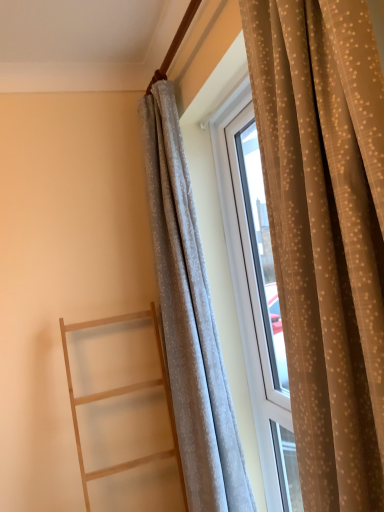
Question: In terms of height, does light wood ladder at left look taller or shorter compared to light gray sheer curtain at right, marked as the 2th curtain in a back-to-front arrangement?

Choices:
 (A) tall
 (B) short

Answer: (B)

Question: In terms of size, does light wood ladder at left appear bigger or smaller than light gray sheer curtain at right, positioned as the 1th curtain in front-to-back order?

Choices:
 (A) small
 (B) big

Answer: (A)

Question: Estimate the real-world distances between objects in this image. Which object is farther from the light gray sheer curtain at right, marked as the 2th curtain in a back-to-front arrangement?

Choices:
 (A) white sheer curtain at center, positioned as the 1th curtain in back-to-front order
 (B) light wood ladder at left

Answer: (B)

Question: Which is nearer to the white sheer curtain at center, the 2th curtain from the front?

Choices:
 (A) light gray sheer curtain at right, marked as the 2th curtain in a back-to-front arrangement
 (B) light wood ladder at left

Answer: (B)